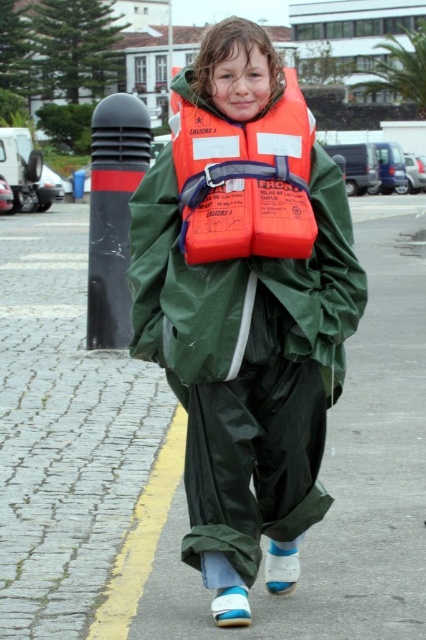
You are a hiker who needs to choose between the orange life vest at center and the orange matte life jacket at center. Which one is positioned to the right side?

The orange life vest at center is positioned to the right of the orange matte life jacket at center.

You are a delivery person trying to navigate through the brick paved road at center and the orange life vest at center. Which object should you avoid stepping on to stay on the correct path?

The brick paved road at center is to the left of the orange life vest at center, so you should avoid stepping on the orange life vest at center and stay on the brick paved road at center.

You are a delivery drone operator. Your drone needs to land on the brick paved road at center. The landing coordinates are at point (181,460). Is this point on the brick paved road at center?

Yes, the point (181,460) is on the brick paved road at center, so the drone can land there safely.